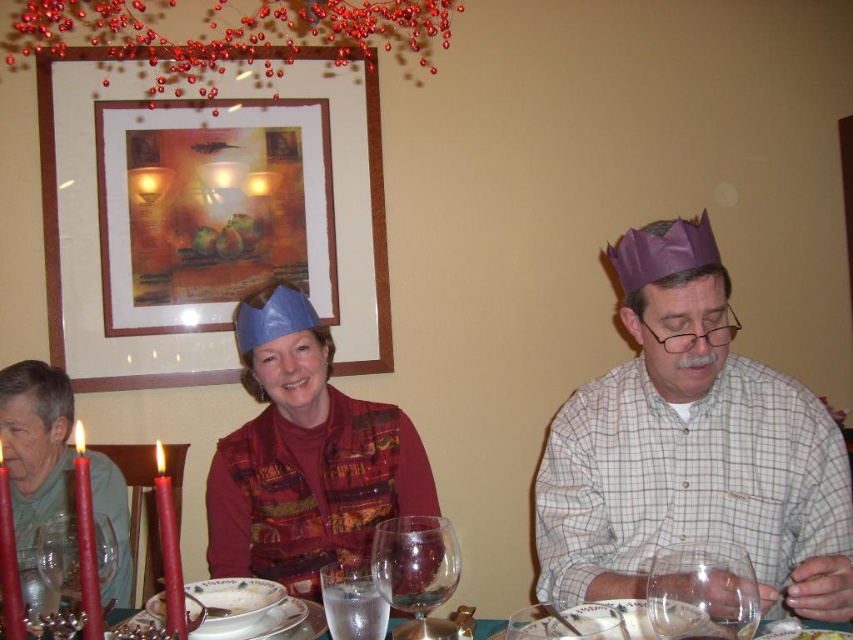
Can you confirm if matte blue paper crown at center is smaller than transparent glass wine glass at lower right?

Incorrect, matte blue paper crown at center is not smaller in size than transparent glass wine glass at lower right.

Between matte blue paper crown at center and transparent glass wine glass at lower right, which one appears on the right side from the viewer's perspective?

From the viewer's perspective, transparent glass wine glass at lower right appears more on the right side.

Is point (239, 556) farther from camera compared to point (695, 544)?

Yes, point (239, 556) is behind point (695, 544).

Identify the location of matte blue paper crown at center. (305, 456).

Is wooden frame at upper center positioned behind clear glass water at center?

That is True.

Does wooden frame at upper center appear under clear glass water at center?

No, wooden frame at upper center is not below clear glass water at center.

Locate an element on the screen. wooden frame at upper center is located at coordinates (206, 218).

Between wooden frame at upper center and matte blue paper crown at center, which one has more height?

wooden frame at upper center is taller.

Is the position of wooden frame at upper center less distant than that of matte blue paper crown at center?

No, wooden frame at upper center is behind matte blue paper crown at center.

Where is `wooden frame at upper center`? The height and width of the screenshot is (640, 853). wooden frame at upper center is located at coordinates (206, 218).

The width and height of the screenshot is (853, 640). I want to click on wooden frame at upper center, so click(206, 218).